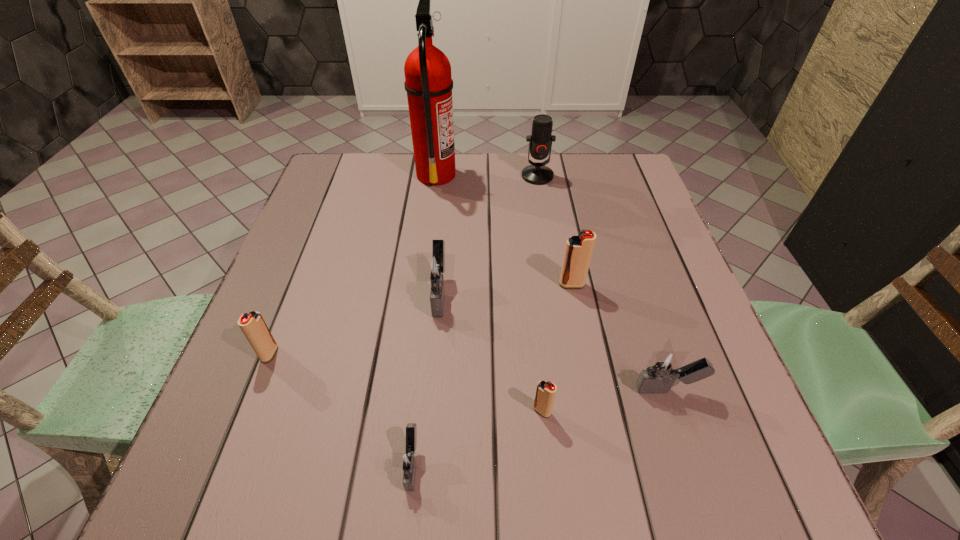
Where is `vacant region at the far left corner of the desktop`? vacant region at the far left corner of the desktop is located at coordinates (332, 158).

Find the location of a particular element. The image size is (960, 540). free space at the far right corner of the desktop is located at coordinates (589, 168).

In order to click on vacant space in between the biggest red igniter and the red microphone in this screenshot , I will do `click(555, 230)`.

In order to click on unoccupied position between the red microphone and the leftmost igniter in this screenshot , I will do `click(403, 265)`.

Identify the location of free space that is in between the fourth igniter from left to right and the rightmost red igniter. (557, 348).

I want to click on free space between the farthest gray igniter and the red microphone, so click(x=489, y=234).

Where is `free space between the leftmost object and the rightmost igniter`? free space between the leftmost object and the rightmost igniter is located at coordinates (468, 372).

Identify the location of vacant space that is in between the farthest gray igniter and the tallest object. (438, 233).

You are a GUI agent. You are given a task and a screenshot of the screen. Output one action in this format:
    pyautogui.click(x=<x>, y=<y>)
    Task: Click on the vacant area that lies between the nearest red igniter and the rightmost igniter
    The height and width of the screenshot is (540, 960).
    Given the screenshot: What is the action you would take?
    pyautogui.click(x=605, y=400)

What are the coordinates of `empty location between the fire extinguisher and the second biggest gray igniter` in the screenshot? It's located at (552, 282).